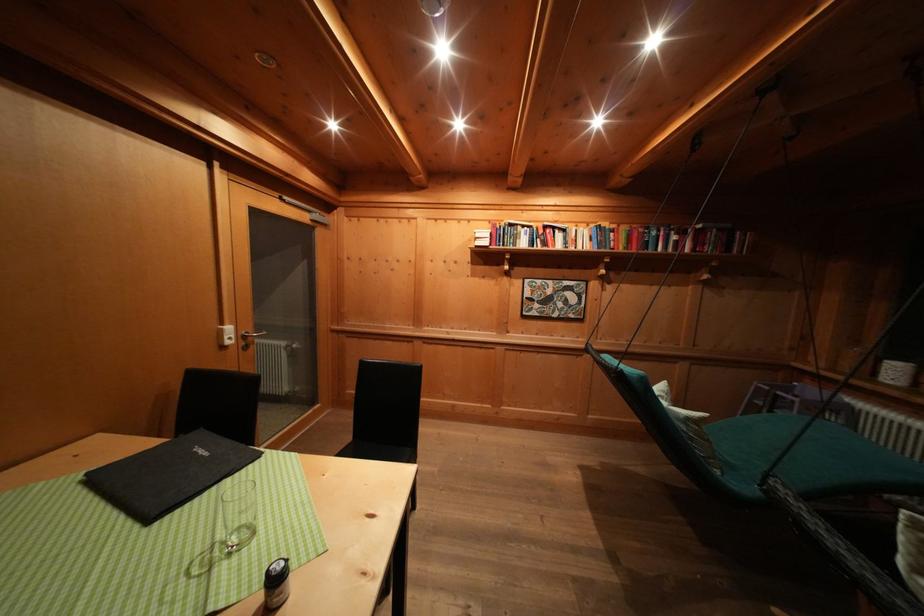
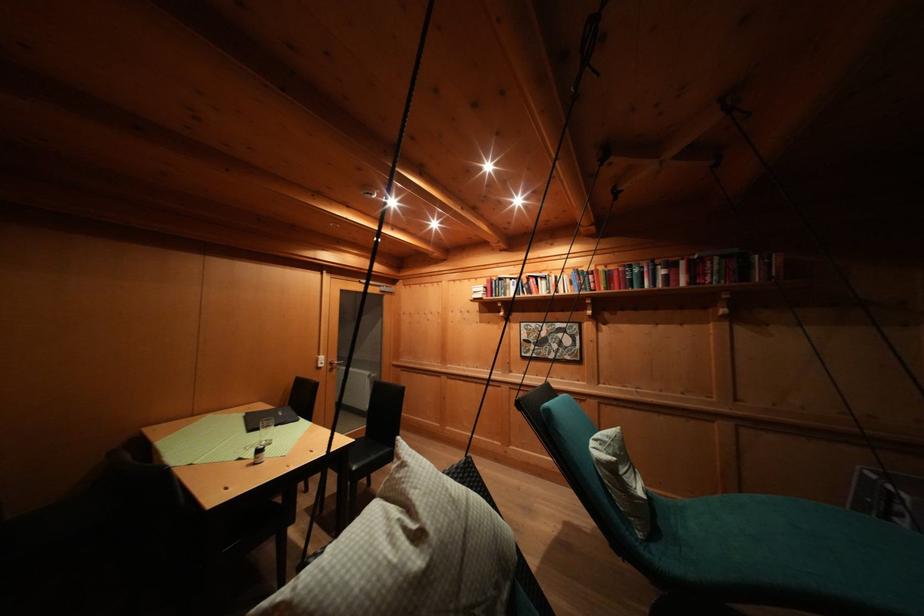
In the second image, find the point that corresponds to point 226,338 in the first image.

(323, 363)